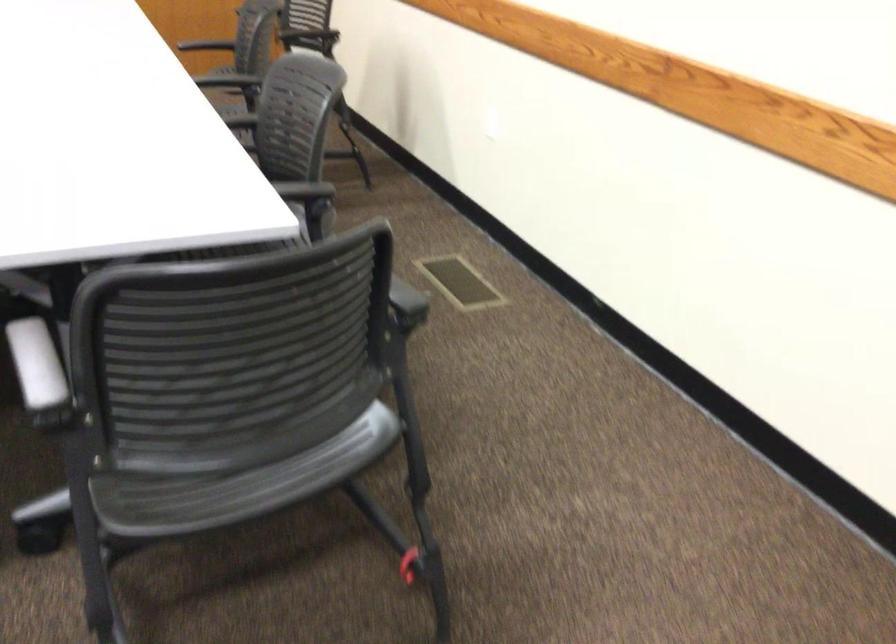
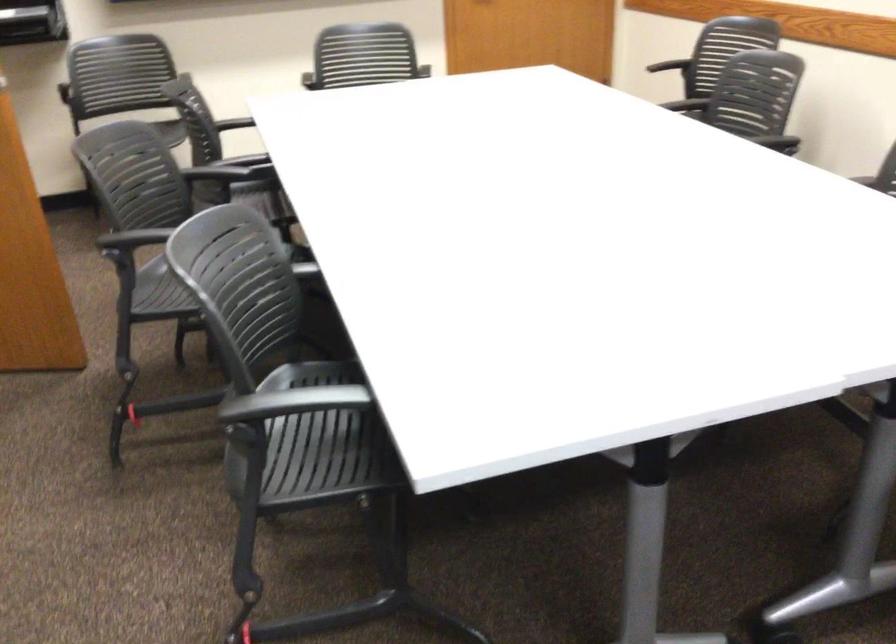
Question: In a continuous first-person perspective shot, in which direction is the camera moving?

Choices:
 (A) Left
 (B) Right
 (C) Forward
 (D) Backward

Answer: (A)